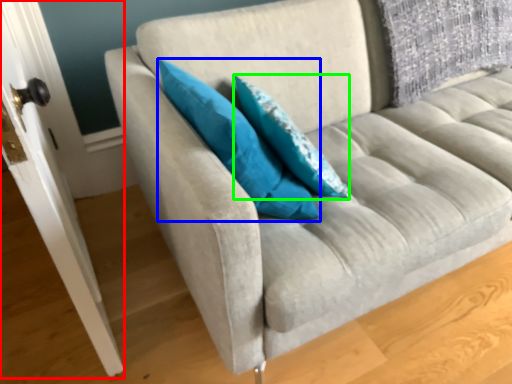
Question: Based on their relative distances, which object is farther from door (highlighted by a red box)? Choose from pillow (highlighted by a blue box) and pillow (highlighted by a green box).

Choices:
 (A) pillow
 (B) pillow

Answer: (B)